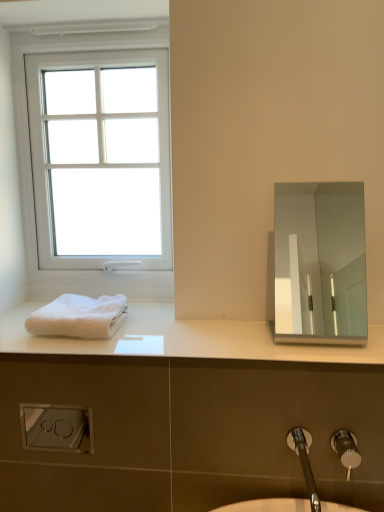
Describe the element at coordinates (320, 263) in the screenshot. I see `polished silver mirror at upper right` at that location.

This screenshot has height=512, width=384. Describe the element at coordinates (79, 317) in the screenshot. I see `white fluffy towel at lower left` at that location.

Locate an element on the screen. white fluffy towel at lower left is located at coordinates point(79,317).

Image resolution: width=384 pixels, height=512 pixels. Describe the element at coordinates (346, 449) in the screenshot. I see `brushed metal faucet at lower right` at that location.

I want to click on white plastic window at upper left, so click(29, 160).

Can you tell me how much white plastic window at upper left and brushed metal faucet at lower right differ in facing direction?

white plastic window at upper left and brushed metal faucet at lower right are facing 2.29 degrees away from each other.

Is brushed metal faucet at lower right inside white plastic window at upper left?

No, brushed metal faucet at lower right is not a part of white plastic window at upper left.

Does white plastic window at upper left have a lesser height compared to brushed metal faucet at lower right?

No, white plastic window at upper left is not shorter than brushed metal faucet at lower right.

Is white plastic window at upper left in front of brushed metal faucet at lower right?

No, it is behind brushed metal faucet at lower right.

Consider the image. From a real-world perspective, which object rests below the other?

brushed metal faucet at lower right, from a real-world perspective.

There is a brushed metal faucet at lower right. At what (x,y) coordinates should I click in order to perform the action: click on mirror above it (from a real-world perspective). Please return your answer as a coordinate pair (x, y). Looking at the image, I should click on (320, 263).

Do you think polished silver mirror at upper right is within brushed metal faucet at lower right, or outside of it?

polished silver mirror at upper right exists outside the volume of brushed metal faucet at lower right.

Is polished silver mirror at upper right far away from brushed metal faucet at lower right?

Yes, polished silver mirror at upper right and brushed metal faucet at lower right are quite far apart.

What's the angular difference between white fluffy towel at lower left and chrome metallic tap at lower right's facing directions?

There is a 1.45-degree angle between the facing directions of white fluffy towel at lower left and chrome metallic tap at lower right.

Would you say white fluffy towel at lower left is a long distance from chrome metallic tap at lower right?

No, there isn't a large distance between white fluffy towel at lower left and chrome metallic tap at lower right.

Considering the sizes of objects white fluffy towel at lower left and chrome metallic tap at lower right in the image provided, who is taller, white fluffy towel at lower left or chrome metallic tap at lower right?

chrome metallic tap at lower right is taller.

Is chrome metallic tap at lower right surrounded by white fluffy towel at lower left?

No.

Can you tell me how much white matte towel at left and chrome metallic tap at lower right differ in facing direction?

The facing directions of white matte towel at left and chrome metallic tap at lower right are 2.49 degrees apart.

At what (x,y) coordinates should I click in order to perform the action: click on counter top that appears on the left of chrome metallic tap at lower right. Please return your answer as a coordinate pair (x, y). The height and width of the screenshot is (512, 384). Looking at the image, I should click on (187, 338).

From the picture: Looking at the image, does white matte towel at left seem bigger or smaller compared to chrome metallic tap at lower right?

In the image, white matte towel at left appears to be larger than chrome metallic tap at lower right.

Which is closer to the camera, (341,356) or (316,497)?

Point (341,356) is positioned closer to the camera compared to point (316,497).

Consider the image. From a real-world perspective, does white plastic window at upper left stand above white matte towel at left?

Yes.

You are a GUI agent. You are given a task and a screenshot of the screen. Output one action in this format:
    pyautogui.click(x=<x>, y=<y>)
    Task: Click on the window lying behind the white matte towel at left
    This screenshot has width=384, height=512.
    Given the screenshot: What is the action you would take?
    pyautogui.click(x=29, y=160)

Between white plastic window at upper left and white matte towel at left, which one has larger width?

Wider between the two is white matte towel at left.

Is white plastic window at upper left facing towards white matte towel at left?

Yes, white plastic window at upper left is aimed at white matte towel at left.

Can you confirm if white matte towel at left is wider than brushed metal faucet at lower right?

Yes.

Would you say brushed metal faucet at lower right is part of white matte towel at left's contents?

No, brushed metal faucet at lower right is located outside of white matte towel at left.

From a real-world perspective, between white matte towel at left and brushed metal faucet at lower right, who is vertically lower?

brushed metal faucet at lower right.

Between chrome metallic tap at lower right and brushed metal faucet at lower right, which one has more height?

Standing taller between the two is brushed metal faucet at lower right.

Considering the relative sizes of chrome metallic tap at lower right and brushed metal faucet at lower right in the image provided, is chrome metallic tap at lower right wider than brushed metal faucet at lower right?

Indeed, chrome metallic tap at lower right has a greater width compared to brushed metal faucet at lower right.

Is chrome metallic tap at lower right to the left of brushed metal faucet at lower right from the viewer's perspective?

Correct, you'll find chrome metallic tap at lower right to the left of brushed metal faucet at lower right.

The height and width of the screenshot is (512, 384). In order to click on window behind the brushed metal faucet at lower right in this screenshot , I will do pos(29,160).

Where is `plumbing fixture that is on the right side of polished silver mirror at upper right`? Image resolution: width=384 pixels, height=512 pixels. plumbing fixture that is on the right side of polished silver mirror at upper right is located at coordinates (346, 449).

From the image, which object appears to be farther from white matte towel at left, polished silver mirror at upper right or chrome metallic tap at lower right?

polished silver mirror at upper right is further to white matte towel at left.

From the picture: Estimate the real-world distances between objects in this image. Which object is further from brushed metal faucet at lower right, white plastic window at upper left or white matte towel at left?

white plastic window at upper left lies further to brushed metal faucet at lower right than the other object.

Looking at the image, which one is located further to white fluffy towel at lower left, chrome metallic tap at lower right or white plastic window at upper left?

Among the two, chrome metallic tap at lower right is located further to white fluffy towel at lower left.

Which object lies nearer to the anchor point white fluffy towel at lower left, brushed metal faucet at lower right or polished silver mirror at upper right?

brushed metal faucet at lower right is closer to white fluffy towel at lower left.

When comparing their distances from chrome metallic tap at lower right, does polished silver mirror at upper right or brushed metal faucet at lower right seem closer?

Among the two, brushed metal faucet at lower right is located nearer to chrome metallic tap at lower right.

Looking at the image, which one is located closer to white matte towel at left, brushed metal faucet at lower right or white fluffy towel at lower left?

white fluffy towel at lower left is positioned closer to the anchor white matte towel at left.

Considering their positions, is white plastic window at upper left positioned closer to white matte towel at left than brushed metal faucet at lower right?

white plastic window at upper left lies closer to white matte towel at left than the other object.

Which object lies nearer to the anchor point white fluffy towel at lower left, polished silver mirror at upper right or white matte towel at left?

white matte towel at left lies closer to white fluffy towel at lower left than the other object.

Identify the location of mirror between white plastic window at upper left and chrome metallic tap at lower right in the up-down direction. Image resolution: width=384 pixels, height=512 pixels. click(320, 263).

The width and height of the screenshot is (384, 512). I want to click on mirror between white plastic window at upper left and brushed metal faucet at lower right, so click(x=320, y=263).

Identify the location of counter top between white fluffy towel at lower left and brushed metal faucet at lower right from left to right. The width and height of the screenshot is (384, 512). (187, 338).

Locate an element on the screen. The image size is (384, 512). counter top between white plastic window at upper left and brushed metal faucet at lower right in the vertical direction is located at coordinates (187, 338).